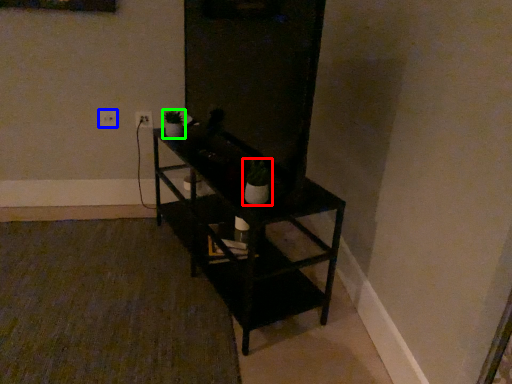
Question: Which object is the closest to the houseplant (highlighted by a red box)? Choose among these: electric outlet (highlighted by a blue box) or houseplant (highlighted by a green box).

Choices:
 (A) electric outlet
 (B) houseplant

Answer: (B)